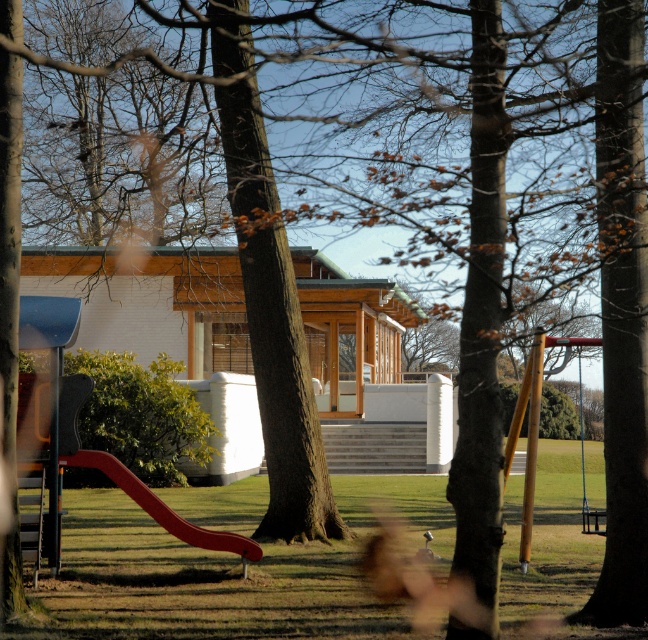
In the scene shown: You are a parent trying to decide which play equipment to let your child use first. The red plastic slide at lower left and the metallic silver swing at right are both available. Based on their sizes, which one might be more suitable for a younger child?

The red plastic slide at lower left has a smaller size compared to the metallic silver swing at right, so it might be more suitable for a younger child due to its smaller dimensions.

You are planning to set up a new playground in the park. You have a red plastic slide at lower left and a metallic silver swing at right. Considering their sizes, which one can fit better in a narrow space?

The red plastic slide at lower left has a smaller width compared to the metallic silver swing at right, so it can fit better in a narrow space.